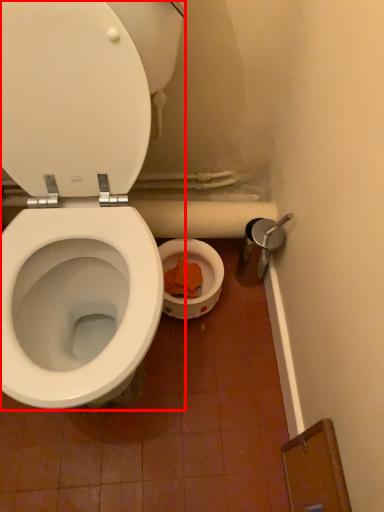
Question: From the image's perspective, what is the correct spatial positioning of toilet (annotated by the red box) in reference to lid?

Choices:
 (A) below
 (B) above

Answer: (A)